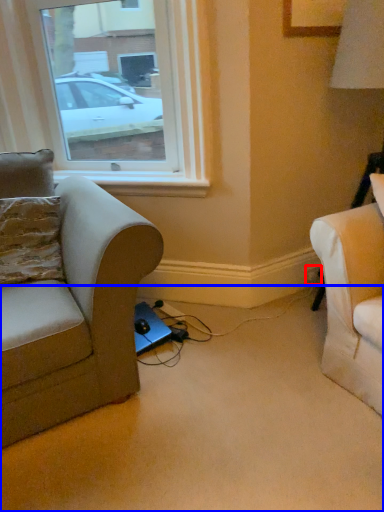
Question: Which object is further to the camera taking this photo, electric outlet (highlighted by a red box) or plain (highlighted by a blue box)?

Choices:
 (A) electric outlet
 (B) plain

Answer: (A)